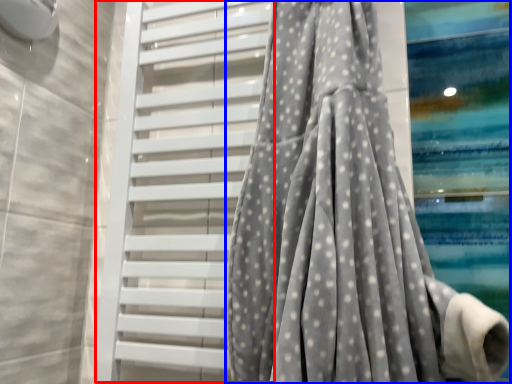
Question: Which of the following is the farthest to the observer, shutter (highlighted by a red box) or curtain (highlighted by a blue box)?

Choices:
 (A) shutter
 (B) curtain

Answer: (A)